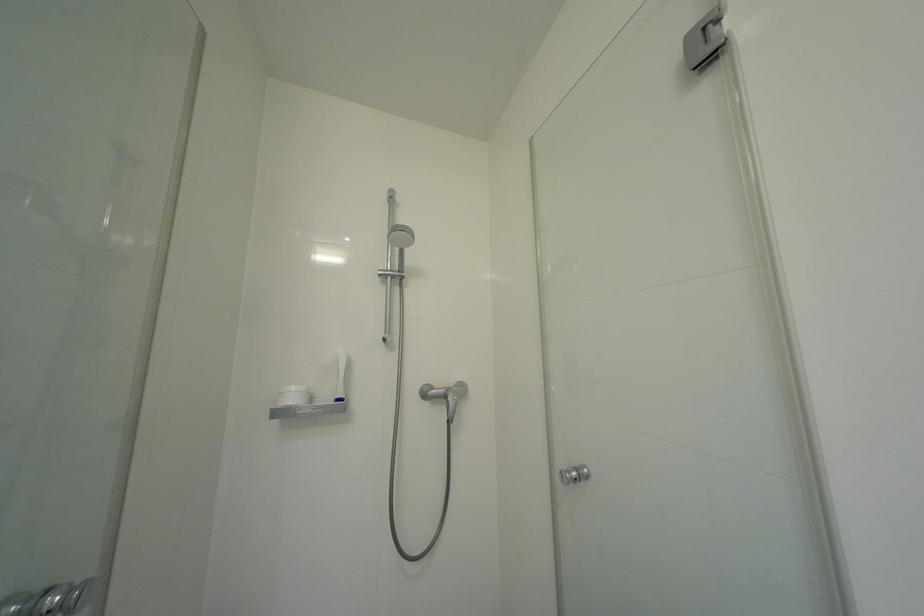
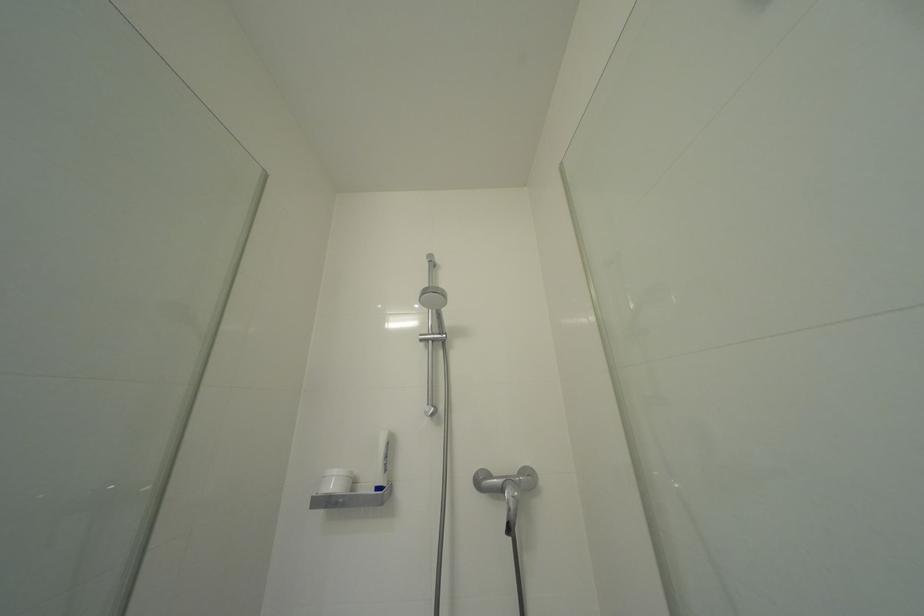
Question: How did the camera likely rotate?

Choices:
 (A) Left
 (B) Right
 (C) Up
 (D) Down

Answer: (A)